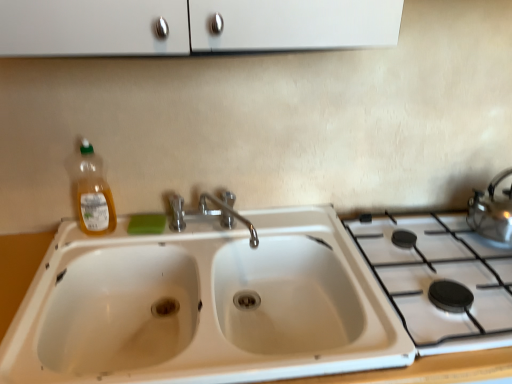
You are a GUI agent. You are given a task and a screenshot of the screen. Output one action in this format:
    pyautogui.click(x=<x>, y=<y>)
    Task: Click on the vacant space to the right of chrome metallic faucet at center
    This screenshot has width=512, height=384.
    Given the screenshot: What is the action you would take?
    pyautogui.click(x=304, y=231)